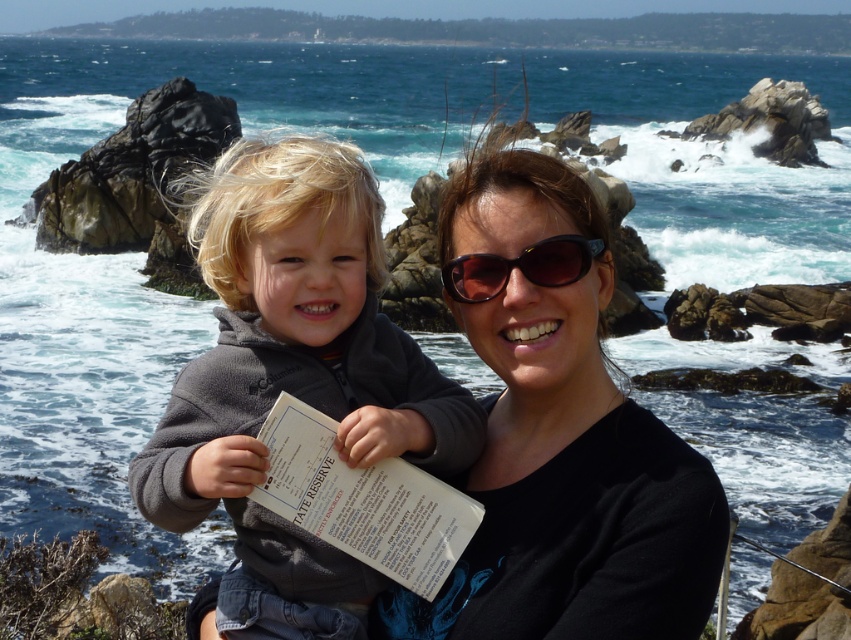
Is the position of black matte sunglasses at upper center more distant than that of gray fleece jacket at left?

No, it is not.

The width and height of the screenshot is (851, 640). In order to click on black matte sunglasses at upper center in this screenshot , I will do `click(558, 436)`.

Consider the image. Who is more distant from viewer, [581,556] or [290,538]?

Point [290,538]

Image resolution: width=851 pixels, height=640 pixels. I want to click on black matte sunglasses at upper center, so click(558, 436).

Does black matte sunglasses at upper center appear under black plastic sunglasses at center?

Yes, black matte sunglasses at upper center is below black plastic sunglasses at center.

Image resolution: width=851 pixels, height=640 pixels. I want to click on black matte sunglasses at upper center, so click(x=558, y=436).

Who is positioned more to the right, gray fleece jacket at left or black plastic sunglasses at center?

Positioned to the right is black plastic sunglasses at center.

Who is lower down, gray fleece jacket at left or black plastic sunglasses at center?

gray fleece jacket at left

What do you see at coordinates (294, 380) in the screenshot? I see `gray fleece jacket at left` at bounding box center [294, 380].

Where is `gray fleece jacket at left`? gray fleece jacket at left is located at coordinates (294, 380).